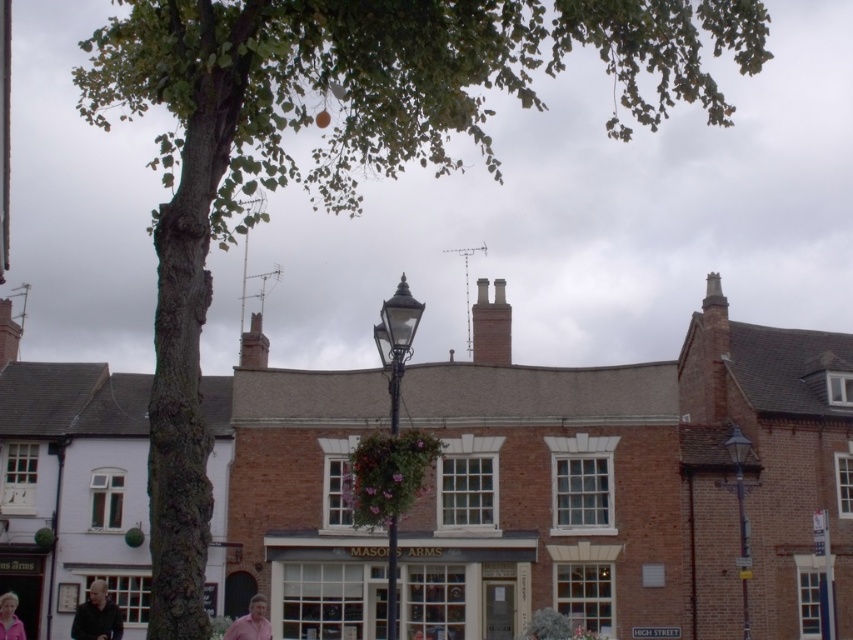
Who is shorter, polished brass lamp post at center or pink fabric at lower left?

pink fabric at lower left is shorter.

Between polished brass lamp post at center and pink fabric at lower left, which one is positioned higher?

polished brass lamp post at center is higher up.

Is point (381, 362) in front of point (10, 634)?

No, it is not.

At what (x,y) coordinates should I click in order to perform the action: click on polished brass lamp post at center. Please return your answer as a coordinate pair (x, y). The width and height of the screenshot is (853, 640). Looking at the image, I should click on (396, 340).

Is white wooden signboard at center smaller than polished brass lamp post at center?

Yes.

Is white wooden signboard at center in front of polished brass lamp post at center?

No, it is not.

Which is behind, point (543, 563) or point (389, 589)?

Positioned behind is point (543, 563).

Image resolution: width=853 pixels, height=640 pixels. In order to click on white wooden signboard at center in this screenshot , I will do `click(485, 580)`.

This screenshot has height=640, width=853. What do you see at coordinates (741, 515) in the screenshot?
I see `matte black lamp post at right` at bounding box center [741, 515].

Is matte black lamp post at right behind pink fabric shirt at lower center?

Yes.

Between point (734, 435) and point (233, 627), which one is positioned behind?

Point (734, 435)

Locate an element on the screen. matte black lamp post at right is located at coordinates (741, 515).